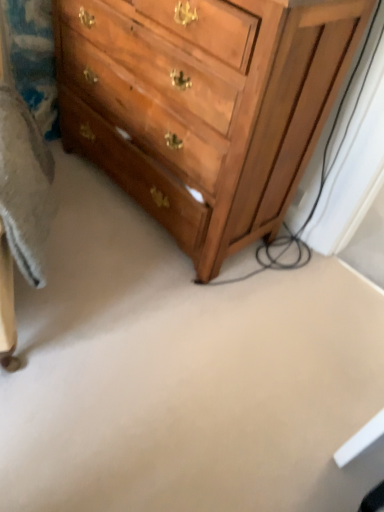
Find the location of a particular element. vacant area that is in front of wooden chest of drawers at upper right is located at coordinates (156, 326).